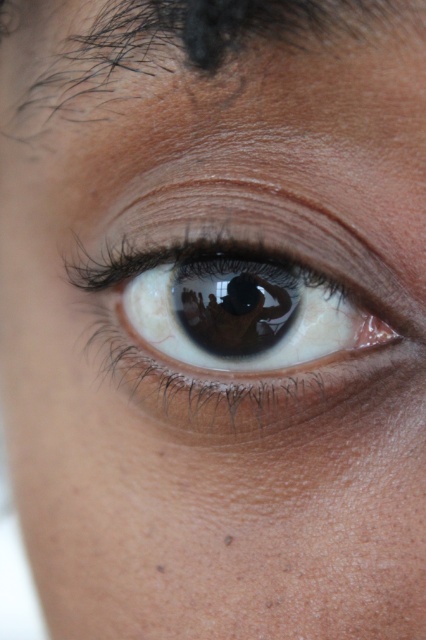
Question: Among these objects, which one is nearest to the camera?

Choices:
 (A) brown glossy eye at center
 (B) dark brown hair at upper center

Answer: (B)

Question: Among these objects, which one is nearest to the camera?

Choices:
 (A) brown glossy eye at center
 (B) dark brown hair at upper center

Answer: (B)

Question: Which point appears closest to the camera in this image?

Choices:
 (A) (293, 234)
 (B) (115, 17)

Answer: (B)

Question: Is brown glossy eye at center to the left of dark brown hair at upper center from the viewer's perspective?

Choices:
 (A) yes
 (B) no

Answer: (B)

Question: Is the position of brown glossy eye at center less distant than that of dark brown hair at upper center?

Choices:
 (A) yes
 (B) no

Answer: (B)

Question: Considering the relative positions of brown glossy eye at center and dark brown hair at upper center in the image provided, where is brown glossy eye at center located with respect to dark brown hair at upper center?

Choices:
 (A) right
 (B) left

Answer: (A)